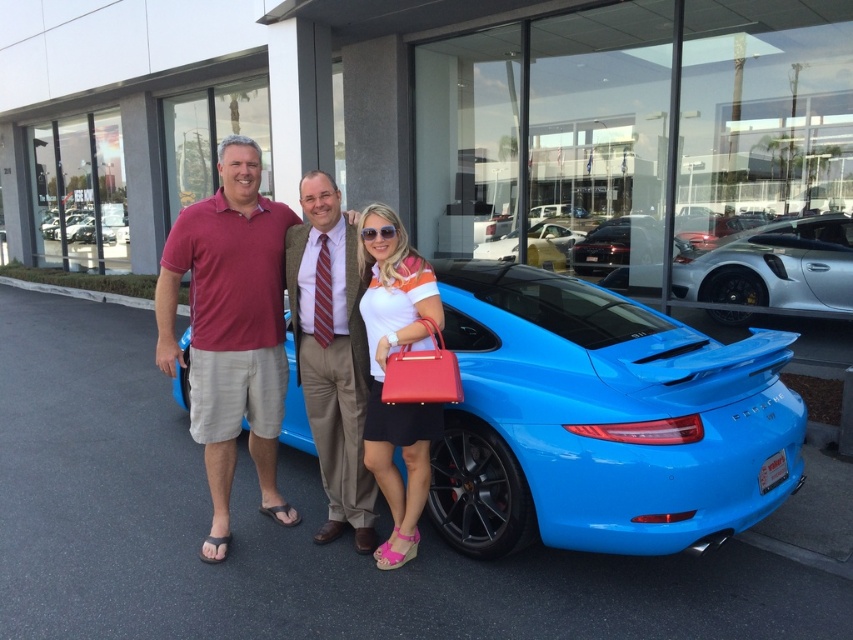
Question: Which object is closer to the camera taking this photo?

Choices:
 (A) glossy metallic car at center
 (B) glossy blue sports car at center
 (C) striped tie at center
 (D) matte red shorts at center

Answer: (D)

Question: Does matte orange shirt at center have a larger size compared to shiny white car at center?

Choices:
 (A) yes
 (B) no

Answer: (B)

Question: Can you confirm if shiny blue car at center is positioned below matte red shorts at center?

Choices:
 (A) yes
 (B) no

Answer: (A)

Question: Which object appears closest to the camera in this image?

Choices:
 (A) shiny white car at center
 (B) glossy metallic car at center

Answer: (A)

Question: Which point appears closest to the camera in this image?

Choices:
 (A) (544, 436)
 (B) (350, 392)
 (C) (657, 237)

Answer: (A)

Question: Where is matte red shorts at center located in relation to glossy blue sports car at center in the image?

Choices:
 (A) left
 (B) right

Answer: (A)